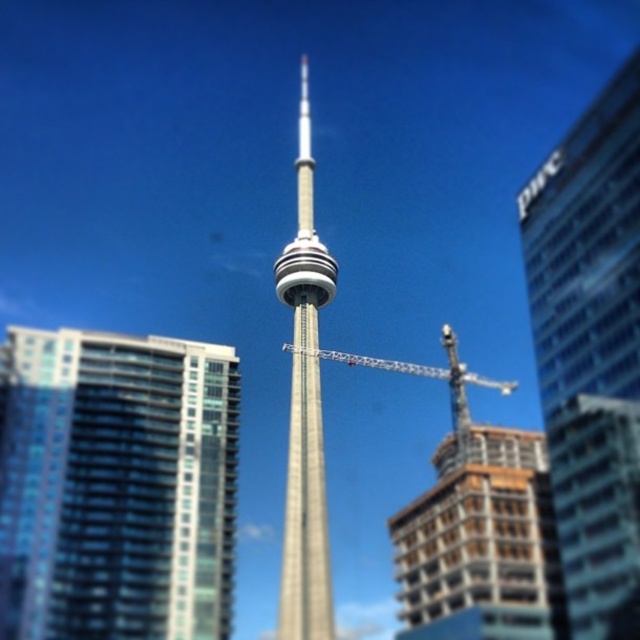
Question: Does glassy reflective building at right have a greater width compared to wooden frame building at lower right?

Choices:
 (A) yes
 (B) no

Answer: (B)

Question: Which point appears closest to the camera in this image?

Choices:
 (A) (580, 321)
 (B) (444, 324)
 (C) (54, 404)
 (D) (483, 513)

Answer: (A)

Question: In this image, where is glassy reflective building at right located relative to metallic gray crane at center?

Choices:
 (A) right
 (B) left

Answer: (A)

Question: Which point is closer to the camera?

Choices:
 (A) glassy reflective building at left
 (B) glassy reflective building at right
 (C) metallic gray crane at center
 (D) wooden frame building at lower right

Answer: (B)

Question: Is glassy reflective building at left further to the viewer compared to wooden frame building at lower right?

Choices:
 (A) yes
 (B) no

Answer: (B)

Question: Which is nearer to the silver metallic cn tower at center?

Choices:
 (A) wooden frame building at lower right
 (B) glassy reflective building at right
 (C) metallic gray crane at center

Answer: (A)